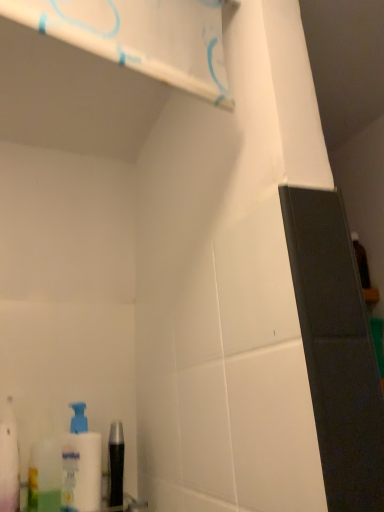
Question: In terms of width, does translucent plastic mouthwash at lower left, acting as the 1th mouthwash starting from the left, look wider or thinner when compared to white plastic bottle at lower left?

Choices:
 (A) wide
 (B) thin

Answer: (B)

Question: Based on their sizes in the image, would you say translucent plastic mouthwash at lower left, the 2th mouthwash viewed from the right, is bigger or smaller than white plastic bottle at lower left?

Choices:
 (A) big
 (B) small

Answer: (B)

Question: Based on their relative distances, which object is nearer to the black glossy mouthwash at lower left, the 2th mouthwash in the left-to-right sequence?

Choices:
 (A) translucent plastic mouthwash at lower left, acting as the 1th mouthwash starting from the left
 (B) white glossy shelf at upper center
 (C) white plastic bottle at lower left
 (D) white plastic pump bottle at lower left

Answer: (D)

Question: Considering the real-world distances, which object is farthest from the black glossy mouthwash at lower left, positioned as the first mouthwash in right-to-left order?

Choices:
 (A) white glossy shelf at upper center
 (B) translucent plastic mouthwash at lower left, acting as the 1th mouthwash starting from the left
 (C) white plastic pump bottle at lower left
 (D) white plastic bottle at lower left

Answer: (A)